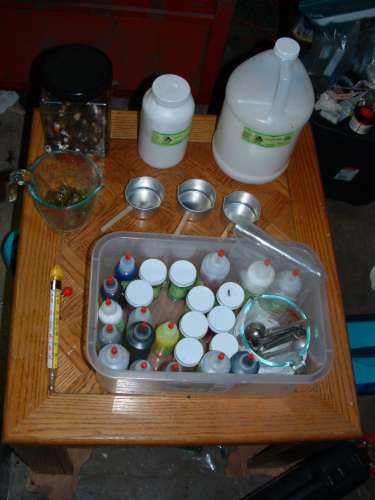
Where is `table legs`? This screenshot has height=500, width=375. table legs is located at coordinates (272, 457), (47, 465).